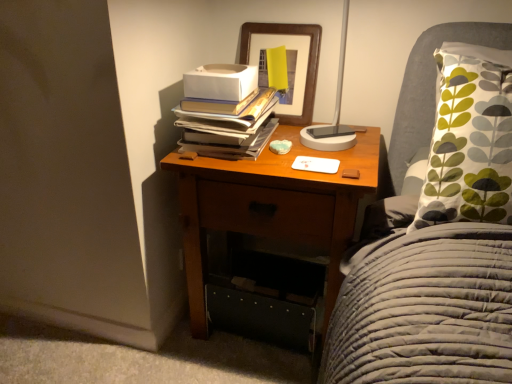
Question: Is hardcover books at upper center wider than wooden nightstand at center?

Choices:
 (A) yes
 (B) no

Answer: (B)

Question: Is hardcover books at upper center further to the viewer compared to wooden nightstand at center?

Choices:
 (A) no
 (B) yes

Answer: (B)

Question: From a real-world perspective, is hardcover books at upper center on wooden nightstand at center?

Choices:
 (A) no
 (B) yes

Answer: (B)

Question: From a real-world perspective, is hardcover books at upper center under wooden nightstand at center?

Choices:
 (A) yes
 (B) no

Answer: (B)

Question: From the image's perspective, is hardcover books at upper center below wooden nightstand at center?

Choices:
 (A) yes
 (B) no

Answer: (B)

Question: From the image's perspective, is hardcover books at upper center on wooden nightstand at center?

Choices:
 (A) yes
 (B) no

Answer: (A)

Question: Is wooden picture frame at upper center inside hardcover books at upper center?

Choices:
 (A) no
 (B) yes

Answer: (A)

Question: Considering the relative positions of hardcover books at upper center and wooden picture frame at upper center in the image provided, is hardcover books at upper center to the left of wooden picture frame at upper center from the viewer's perspective?

Choices:
 (A) yes
 (B) no

Answer: (A)

Question: Can you confirm if hardcover books at upper center is smaller than wooden picture frame at upper center?

Choices:
 (A) no
 (B) yes

Answer: (B)

Question: Is hardcover books at upper center further to the viewer compared to wooden picture frame at upper center?

Choices:
 (A) no
 (B) yes

Answer: (A)

Question: From a real-world perspective, does hardcover books at upper center stand above wooden picture frame at upper center?

Choices:
 (A) no
 (B) yes

Answer: (A)

Question: Is hardcover books at upper center turned away from wooden picture frame at upper center?

Choices:
 (A) no
 (B) yes

Answer: (B)

Question: Is wooden nightstand at center oriented away from wooden picture frame at upper center?

Choices:
 (A) no
 (B) yes

Answer: (A)